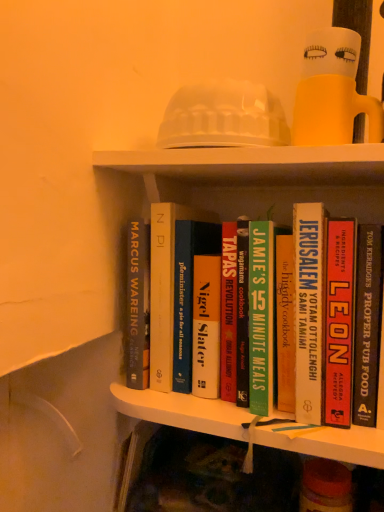
You are a GUI agent. You are given a task and a screenshot of the screen. Output one action in this format:
    pyautogui.click(x=<x>, y=<y>)
    Task: Click on the hardcover cookbook at center, arranged as the 3th book when viewed from the right
    Image resolution: width=384 pixels, height=512 pixels.
    Given the screenshot: What is the action you would take?
    pyautogui.click(x=309, y=309)

The width and height of the screenshot is (384, 512). Describe the element at coordinates (263, 316) in the screenshot. I see `green matte book at center, the second book positioned from the left` at that location.

This screenshot has height=512, width=384. Find the location of `black hardcover book at right, the first book when ordered from right to left`. black hardcover book at right, the first book when ordered from right to left is located at coordinates (367, 324).

This screenshot has width=384, height=512. I want to click on hardcover book at center, which is counted as the 5th book, starting from the right, so click(165, 287).

Identify the location of translucent plastic doll at upper center. The width and height of the screenshot is (384, 512). (332, 92).

Locate an element on the screen. This screenshot has width=384, height=512. hardcover cookbook at center, arranged as the 3th book when viewed from the right is located at coordinates (309, 309).

Is hardcover book at center, which ranks as the 2th book in right-to-left order, inside the boundaries of black hardcover book at right, the first book when ordered from right to left, or outside?

hardcover book at center, which ranks as the 2th book in right-to-left order, is not enclosed by black hardcover book at right, the first book when ordered from right to left.

Is hardcover book at center, which ranks as the 2th book in right-to-left order, positioned with its back to black hardcover book at right, the 5th book from the left?

hardcover book at center, which ranks as the 2th book in right-to-left order, is not turned away from black hardcover book at right, the 5th book from the left.

Does hardcover book at center, which ranks as the 2th book in right-to-left order, touch black hardcover book at right, the 5th book from the left?

Yes, hardcover book at center, which ranks as the 2th book in right-to-left order, is with black hardcover book at right, the 5th book from the left.

How many degrees apart are the facing directions of hardcover book at center, which ranks as the 2th book in right-to-left order, and black hardcover book at right, the 5th book from the left?

They differ by 0.454 degrees in their facing directions.

From the picture: Can you confirm if black hardcover book at right, the first book when ordered from right to left, is smaller than hardcover cookbook at center, marked as the 3th book in a left-to-right arrangement?

Correct, black hardcover book at right, the first book when ordered from right to left, occupies less space than hardcover cookbook at center, marked as the 3th book in a left-to-right arrangement.

Which is more to the right, black hardcover book at right, the 5th book from the left, or hardcover cookbook at center, arranged as the 3th book when viewed from the right?

From the viewer's perspective, black hardcover book at right, the 5th book from the left, appears more on the right side.

From the image's perspective, relative to hardcover cookbook at center, arranged as the 3th book when viewed from the right, is black hardcover book at right, the 5th book from the left, above or below?

black hardcover book at right, the 5th book from the left, is situated lower than hardcover cookbook at center, arranged as the 3th book when viewed from the right, in the image.

From a real-world perspective, does black hardcover book at right, the first book when ordered from right to left, stand above hardcover cookbook at center, marked as the 3th book in a left-to-right arrangement?

Incorrect, from a real-world perspective, black hardcover book at right, the first book when ordered from right to left, is lower than hardcover cookbook at center, marked as the 3th book in a left-to-right arrangement.

Does hardcover book at center, placed as the fourth book when sorted from left to right, lie behind translucent plastic doll at upper center?

Yes, hardcover book at center, placed as the fourth book when sorted from left to right, is behind translucent plastic doll at upper center.

Can you see hardcover book at center, which ranks as the 2th book in right-to-left order, touching translucent plastic doll at upper center?

No, hardcover book at center, which ranks as the 2th book in right-to-left order, is not making contact with translucent plastic doll at upper center.

Which of these two, hardcover book at center, placed as the fourth book when sorted from left to right, or translucent plastic doll at upper center, is smaller?

With smaller size is translucent plastic doll at upper center.

Between point (354, 266) and point (368, 108), which one is positioned behind?

Point (368, 108)

Identify the location of book that appears behind the green matte book at center, acting as the fourth book starting from the right. (165, 287).

From the image's perspective, is green matte book at center, the second book positioned from the left, under hardcover book at center, the first book when ordered from left to right?

Yes.

Does green matte book at center, acting as the fourth book starting from the right, have a smaller size compared to hardcover book at center, which is counted as the 5th book, starting from the right?

Indeed, green matte book at center, acting as the fourth book starting from the right, has a smaller size compared to hardcover book at center, which is counted as the 5th book, starting from the right.

Could you tell me if green matte book at center, acting as the fourth book starting from the right, is turned towards hardcover book at center, which is counted as the 5th book, starting from the right?

No, green matte book at center, acting as the fourth book starting from the right, is not oriented towards hardcover book at center, which is counted as the 5th book, starting from the right.

Considering the relative sizes of hardcover cookbook at center, arranged as the 3th book when viewed from the right, and hardcover book at center, which ranks as the 2th book in right-to-left order, in the image provided, is hardcover cookbook at center, arranged as the 3th book when viewed from the right, thinner than hardcover book at center, which ranks as the 2th book in right-to-left order,?

No, hardcover cookbook at center, arranged as the 3th book when viewed from the right, is not thinner than hardcover book at center, which ranks as the 2th book in right-to-left order.

From the picture: From a real-world perspective, is hardcover cookbook at center, marked as the 3th book in a left-to-right arrangement, located higher than hardcover book at center, which ranks as the 2th book in right-to-left order?

Correct, in the physical world, hardcover cookbook at center, marked as the 3th book in a left-to-right arrangement, is higher than hardcover book at center, which ranks as the 2th book in right-to-left order.

Could you tell me if hardcover cookbook at center, marked as the 3th book in a left-to-right arrangement, is turned towards hardcover book at center, which ranks as the 2th book in right-to-left order?

No, hardcover cookbook at center, marked as the 3th book in a left-to-right arrangement, is not turned towards hardcover book at center, which ranks as the 2th book in right-to-left order.

Is point (302, 272) positioned behind point (335, 411)?

Yes.

Consider the image. In terms of size, does green matte book at center, the second book positioned from the left, appear bigger or smaller than hardcover cookbook at center, marked as the 3th book in a left-to-right arrangement?

Clearly, green matte book at center, the second book positioned from the left, is smaller in size than hardcover cookbook at center, marked as the 3th book in a left-to-right arrangement.

Is green matte book at center, the second book positioned from the left, beside hardcover cookbook at center, arranged as the 3th book when viewed from the right?

Yes, green matte book at center, the second book positioned from the left, is next to hardcover cookbook at center, arranged as the 3th book when viewed from the right.

Is green matte book at center, the second book positioned from the left, oriented towards hardcover cookbook at center, arranged as the 3th book when viewed from the right?

No.

Considering the positions of objects green matte book at center, acting as the fourth book starting from the right, and hardcover cookbook at center, marked as the 3th book in a left-to-right arrangement, in the image provided, who is more to the right, green matte book at center, acting as the fourth book starting from the right, or hardcover cookbook at center, marked as the 3th book in a left-to-right arrangement,?

hardcover cookbook at center, marked as the 3th book in a left-to-right arrangement, is more to the right.

Considering the positions of point (329, 99) and point (271, 280), is point (329, 99) closer or farther from the camera than point (271, 280)?

Point (329, 99) is closer to the camera than point (271, 280).

From the image's perspective, is translucent plastic doll at upper center located above green matte book at center, acting as the fourth book starting from the right?

Yes.

Consider the image. Is translucent plastic doll at upper center looking in the opposite direction of green matte book at center, the second book positioned from the left?

translucent plastic doll at upper center does not have its back to green matte book at center, the second book positioned from the left.

In order to click on the 2nd book to the left of the translucent plastic doll at upper center, counting from the anchor's position in this screenshot , I will do `click(263, 316)`.

Locate an element on the screen. book that is the 2nd one below the hardcover book at center, placed as the fourth book when sorted from left to right (from a real-world perspective) is located at coordinates (367, 324).

You are a GUI agent. You are given a task and a screenshot of the screen. Output one action in this format:
    pyautogui.click(x=<x>, y=<y>)
    Task: Click on the book that is the 2nd one when counting rightward from the hardcover cookbook at center, arranged as the 3th book when viewed from the right
    
    Given the screenshot: What is the action you would take?
    pyautogui.click(x=367, y=324)

Estimate the real-world distances between objects in this image. Which object is closer to black hardcover book at right, the 5th book from the left, hardcover book at center, which is counted as the 5th book, starting from the right, or hardcover cookbook at center, arranged as the 3th book when viewed from the right?

hardcover cookbook at center, arranged as the 3th book when viewed from the right, is positioned closer to the anchor black hardcover book at right, the 5th book from the left.

Looking at the image, which one is located closer to translucent plastic doll at upper center, hardcover cookbook at center, marked as the 3th book in a left-to-right arrangement, or hardcover book at center, which is counted as the 5th book, starting from the right?

hardcover cookbook at center, marked as the 3th book in a left-to-right arrangement, is positioned closer to the anchor translucent plastic doll at upper center.

From the image, which object appears to be farther from black hardcover book at right, the first book when ordered from right to left, hardcover book at center, which ranks as the 2th book in right-to-left order, or green matte book at center, the second book positioned from the left?

The object further to black hardcover book at right, the first book when ordered from right to left, is green matte book at center, the second book positioned from the left.

Based on their spatial positions, is hardcover cookbook at center, marked as the 3th book in a left-to-right arrangement, or hardcover book at center, placed as the fourth book when sorted from left to right, closer to translucent plastic doll at upper center?

hardcover cookbook at center, marked as the 3th book in a left-to-right arrangement, lies closer to translucent plastic doll at upper center than the other object.

Estimate the real-world distances between objects in this image. Which object is closer to hardcover cookbook at center, marked as the 3th book in a left-to-right arrangement, black hardcover book at right, the 5th book from the left, or hardcover book at center, which is counted as the 5th book, starting from the right?

black hardcover book at right, the 5th book from the left.

Considering their positions, is translucent plastic doll at upper center positioned closer to hardcover cookbook at center, arranged as the 3th book when viewed from the right, than green matte book at center, the second book positioned from the left?

Based on the image, green matte book at center, the second book positioned from the left, appears to be nearer to hardcover cookbook at center, arranged as the 3th book when viewed from the right.

When comparing their distances from hardcover cookbook at center, marked as the 3th book in a left-to-right arrangement, does black hardcover book at right, the first book when ordered from right to left, or green matte book at center, the second book positioned from the left, seem closer?

green matte book at center, the second book positioned from the left, is closer to hardcover cookbook at center, marked as the 3th book in a left-to-right arrangement.

From the image, which object appears to be nearer to black hardcover book at right, the first book when ordered from right to left, hardcover book at center, the first book when ordered from left to right, or translucent plastic doll at upper center?

Among the two, translucent plastic doll at upper center is located nearer to black hardcover book at right, the first book when ordered from right to left.

Find the location of a particular element. The width and height of the screenshot is (384, 512). book between hardcover cookbook at center, marked as the 3th book in a left-to-right arrangement, and black hardcover book at right, the first book when ordered from right to left, from left to right is located at coordinates (339, 321).

Find the location of `book between green matte book at center, the second book positioned from the left, and hardcover book at center, placed as the fourth book when sorted from left to right, in the horizontal direction`. book between green matte book at center, the second book positioned from the left, and hardcover book at center, placed as the fourth book when sorted from left to right, in the horizontal direction is located at coordinates (309, 309).

Image resolution: width=384 pixels, height=512 pixels. Identify the location of book located between hardcover book at center, the first book when ordered from left to right, and hardcover cookbook at center, marked as the 3th book in a left-to-right arrangement, in the left-right direction. tap(263, 316).

I want to click on book that lies between translucent plastic doll at upper center and hardcover cookbook at center, arranged as the 3th book when viewed from the right, from top to bottom, so click(x=165, y=287).